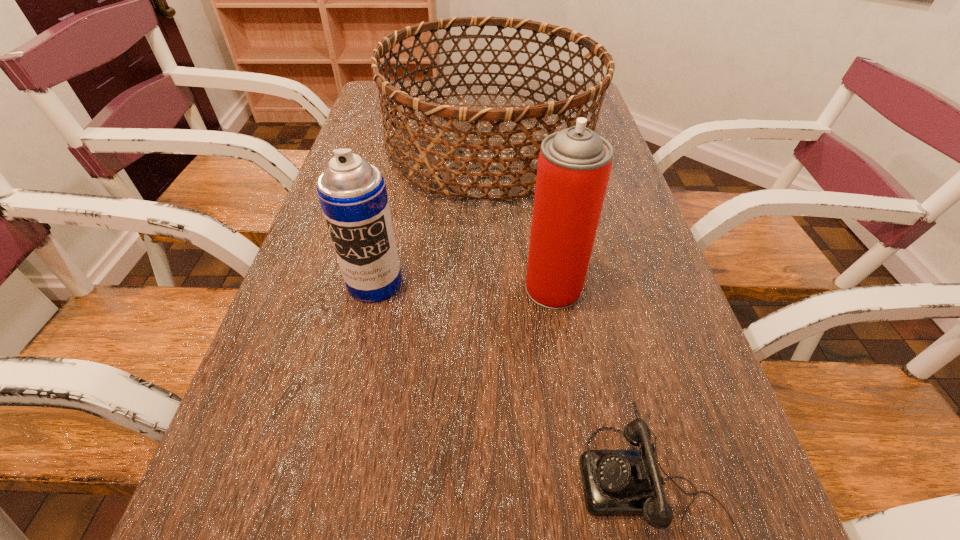
Where is `free space that is in between the farthest object and the shorter aerosol can`? The width and height of the screenshot is (960, 540). free space that is in between the farthest object and the shorter aerosol can is located at coordinates (433, 216).

Where is `object identified as the second closest to the left aerosol can`? object identified as the second closest to the left aerosol can is located at coordinates (574, 165).

Identify the location of object that stands as the second closest to the left aerosol can. The height and width of the screenshot is (540, 960). (574, 165).

Identify the location of free space that satisfies the following two spatial constraints: 1. on the label side of the shorter aerosol can; 2. on the left side of the taller aerosol can. The height and width of the screenshot is (540, 960). (373, 288).

You are a GUI agent. You are given a task and a screenshot of the screen. Output one action in this format:
    pyautogui.click(x=<x>, y=<y>)
    Task: Click on the free point that satisfies the following two spatial constraints: 1. on the label side of the taller aerosol can; 2. on the right side of the left aerosol can
    
    Given the screenshot: What is the action you would take?
    pyautogui.click(x=373, y=288)